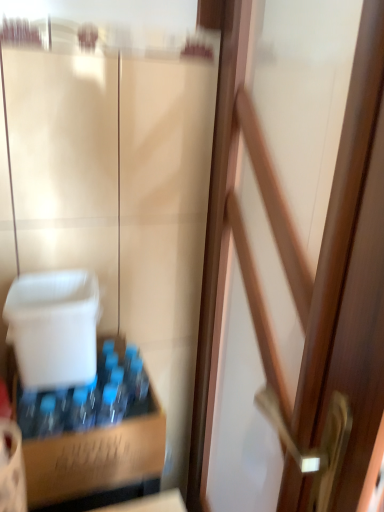
Question: Does wooden door at center have a lesser height compared to brown cardboard box at lower left?

Choices:
 (A) no
 (B) yes

Answer: (A)

Question: Is wooden door at center bigger than brown cardboard box at lower left?

Choices:
 (A) yes
 (B) no

Answer: (A)

Question: Is wooden door at center taller than brown cardboard box at lower left?

Choices:
 (A) yes
 (B) no

Answer: (A)

Question: Is wooden door at center facing towards brown cardboard box at lower left?

Choices:
 (A) yes
 (B) no

Answer: (A)

Question: Is wooden door at center positioned far away from brown cardboard box at lower left?

Choices:
 (A) yes
 (B) no

Answer: (B)

Question: Is wooden door at center positioned with its back to brown cardboard box at lower left?

Choices:
 (A) no
 (B) yes

Answer: (B)

Question: Can we say brown cardboard box at lower left lies outside wooden door at center?

Choices:
 (A) yes
 (B) no

Answer: (A)

Question: From a real-world perspective, is brown cardboard box at lower left physically above wooden door at center?

Choices:
 (A) no
 (B) yes

Answer: (A)

Question: Does brown cardboard box at lower left appear on the left side of wooden door at center?

Choices:
 (A) no
 (B) yes

Answer: (B)

Question: Does brown cardboard box at lower left have a lesser width compared to wooden door at center?

Choices:
 (A) no
 (B) yes

Answer: (A)

Question: Considering the relative sizes of brown cardboard box at lower left and wooden door at center in the image provided, is brown cardboard box at lower left taller than wooden door at center?

Choices:
 (A) yes
 (B) no

Answer: (B)

Question: Can you confirm if brown cardboard box at lower left is bigger than wooden door at center?

Choices:
 (A) no
 (B) yes

Answer: (A)

Question: Looking at the image, does brown cardboard box at lower left seem bigger or smaller compared to wooden door at center?

Choices:
 (A) small
 (B) big

Answer: (A)